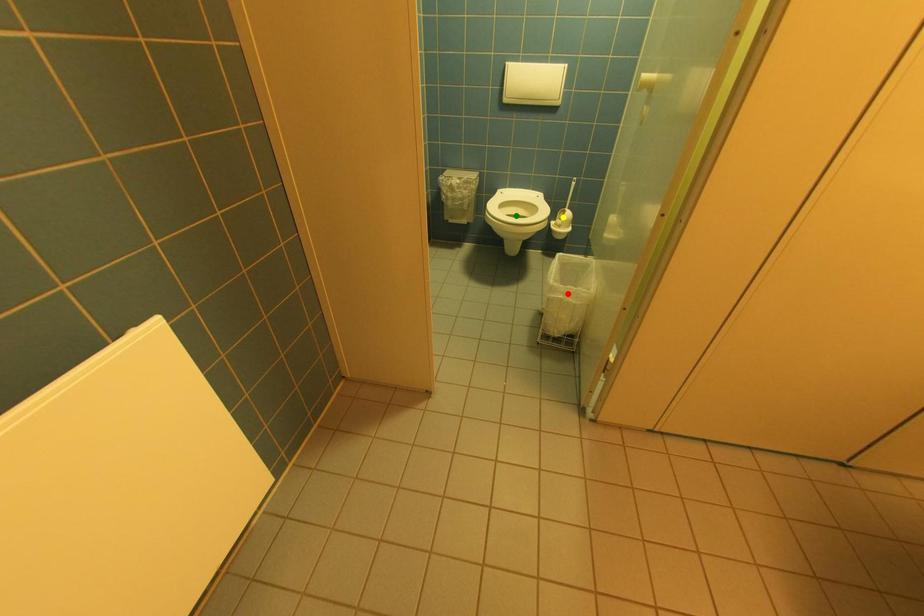
Order these from nearest to farthest:
1. yellow point
2. green point
3. red point

red point < green point < yellow point